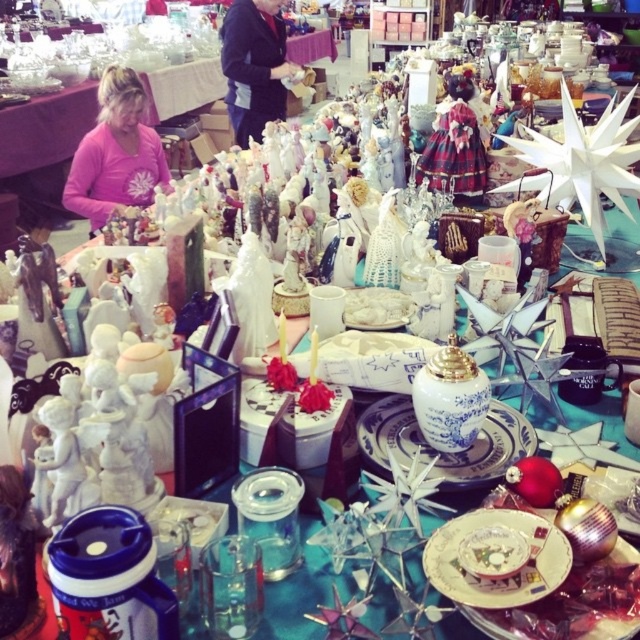
Question: Does pink fabric shirt at center appear on the left side of black fabric at upper center?

Choices:
 (A) yes
 (B) no

Answer: (A)

Question: Which point appears closest to the camera in this image?

Choices:
 (A) (109, 172)
 (B) (227, 81)

Answer: (A)

Question: Which object appears farthest from the camera in this image?

Choices:
 (A) pink fabric shirt at center
 (B) black fabric at upper center

Answer: (B)

Question: Does pink fabric shirt at center appear on the left side of black fabric at upper center?

Choices:
 (A) yes
 (B) no

Answer: (A)

Question: Is pink fabric shirt at center positioned in front of black fabric at upper center?

Choices:
 (A) no
 (B) yes

Answer: (B)

Question: Among these points, which one is farthest from the camera?

Choices:
 (A) (230, 120)
 (B) (109, 172)

Answer: (A)